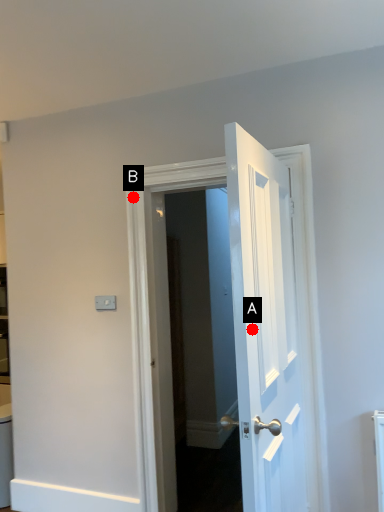
Question: Two points are circled on the image, labeled by A and B beside each circle. Which of the following is the closest to the observer?

Choices:
 (A) A is closer
 (B) B is closer

Answer: (A)